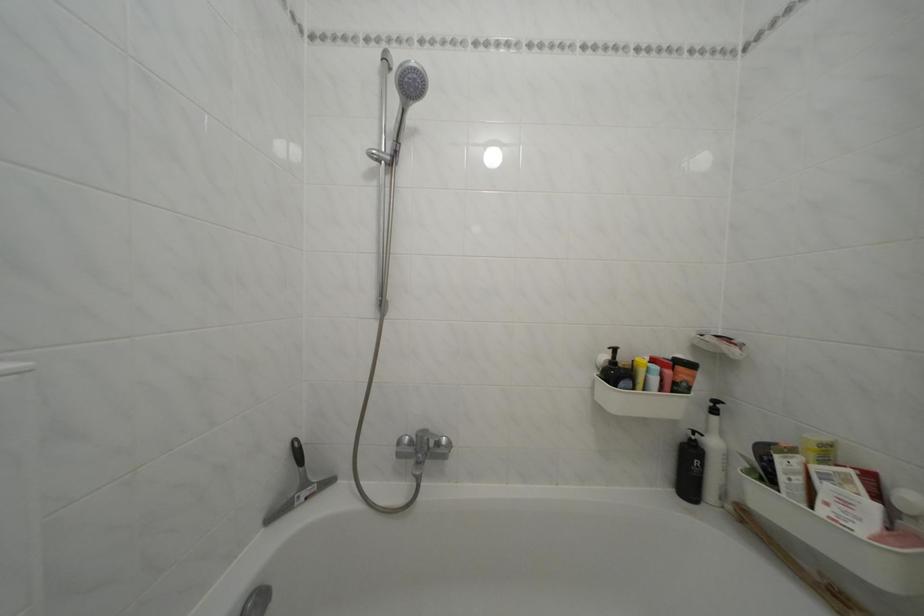
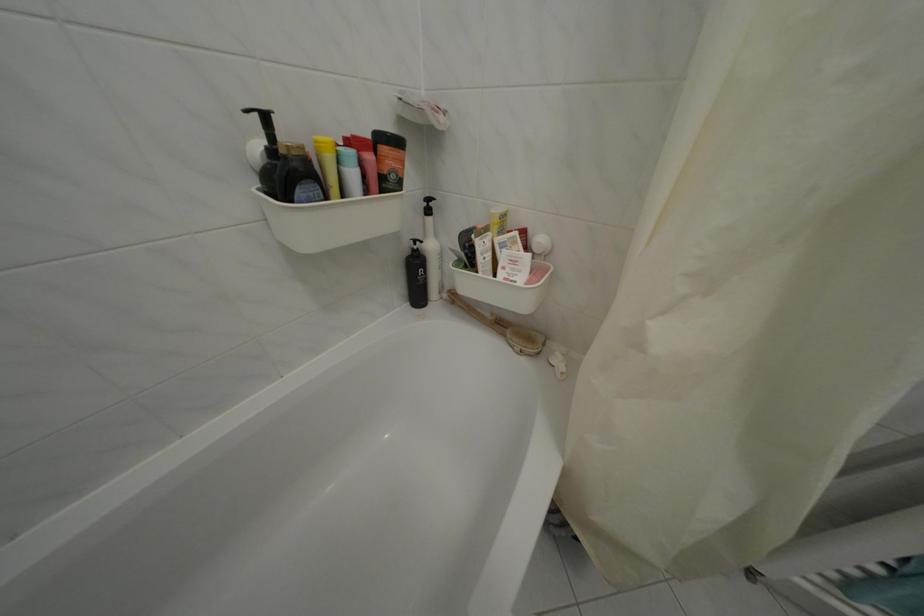
In the second image, find the point that corresponds to (737,514) in the first image.

(454, 302)